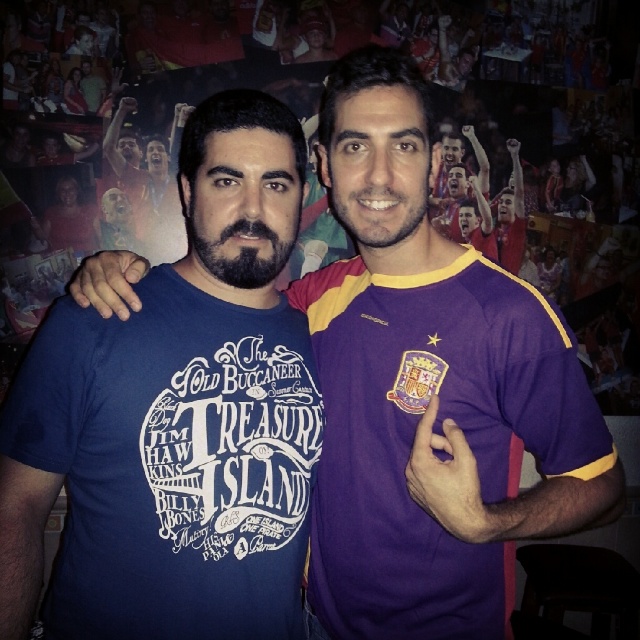
You are standing at the origin point in the image. Which of the two points, point (20, 394) or point (326, 560), is closer to you?

Point (20, 394) is in front of point (326, 560), so it is closer to you.